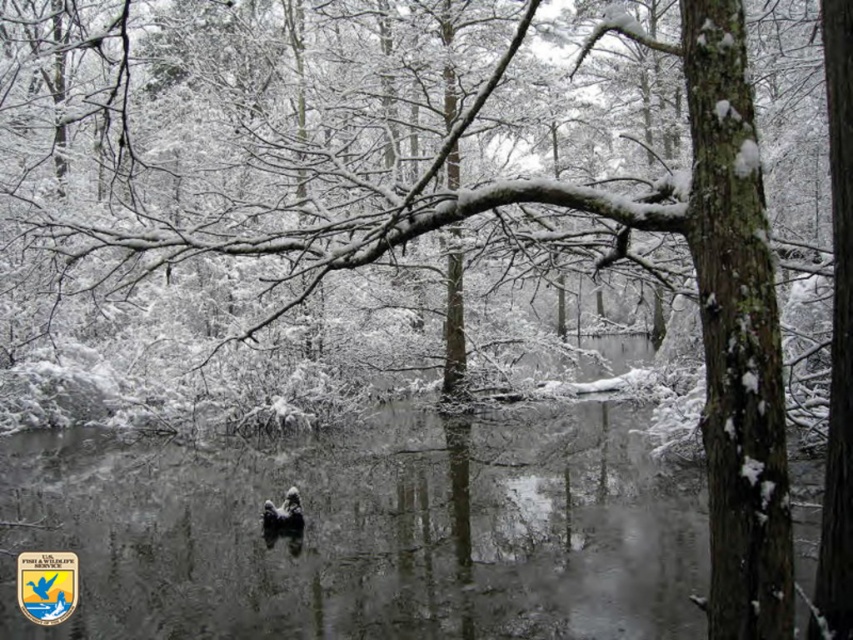
Who is positioned more to the right, clear water at center or dark gray fur at center?

From the viewer's perspective, clear water at center appears more on the right side.

Who is more forward, (614,548) or (265,504)?

Result: Point (614,548) is in front.

Is point (364, 481) positioned in front of point (270, 524)?

No, (364, 481) is further to viewer.

This screenshot has width=853, height=640. What are the coordinates of `clear water at center` in the screenshot? It's located at (369, 532).